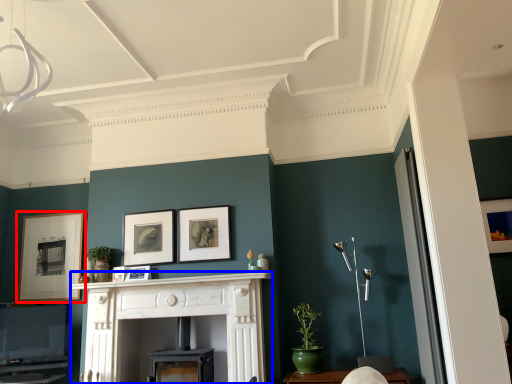
Question: Among these objects, which one is nearest to the camera, picture frame (highlighted by a red box) or fireplace (highlighted by a blue box)?

Choices:
 (A) picture frame
 (B) fireplace

Answer: (B)